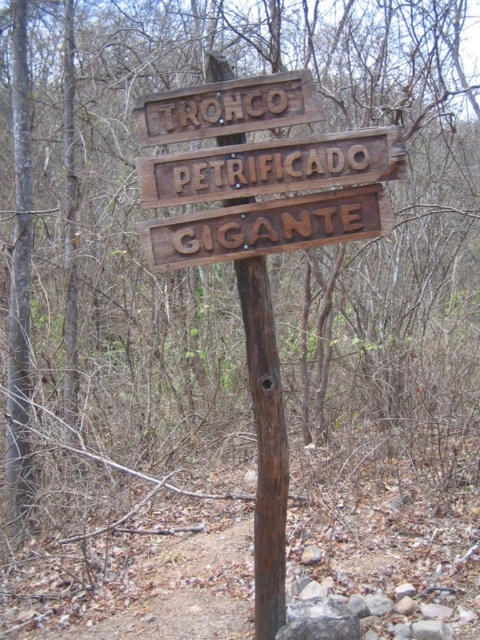
Question: Which of the following is the farthest from the observer?

Choices:
 (A) (136, 120)
 (B) (208, 148)
 (C) (167, 248)

Answer: (C)

Question: Is brown carved wood sign at center positioned before brown wooden sign at upper center?

Choices:
 (A) yes
 (B) no

Answer: (B)

Question: Does brown wooden sign at center appear on the right side of brown carved wood sign at center?

Choices:
 (A) yes
 (B) no

Answer: (A)

Question: Which is farther from the brown carved wood sign at center?

Choices:
 (A) brown wooden sign at upper center
 (B) brown wooden sign at center

Answer: (A)

Question: Can you confirm if brown wooden sign at center is smaller than brown wooden sign at upper center?

Choices:
 (A) yes
 (B) no

Answer: (B)

Question: Estimate the real-world distances between objects in this image. Which object is farther from the brown wooden sign at upper center?

Choices:
 (A) brown carved wood sign at center
 (B) brown wooden sign at center

Answer: (A)